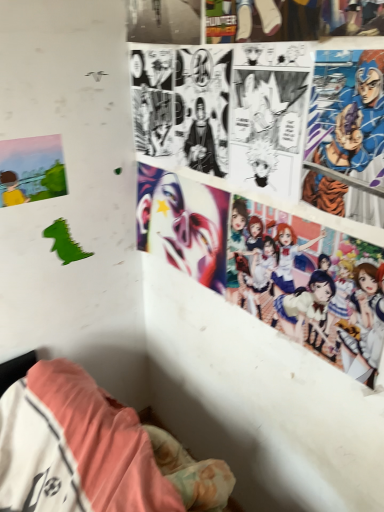
Find the location of a particular element. shiny metallic mask at center is located at coordinates (188, 228).

The width and height of the screenshot is (384, 512). What do you see at coordinates (346, 141) in the screenshot? I see `blue metallic armor at upper right, acting as the 1th person starting from the top` at bounding box center [346, 141].

Describe the element at coordinates (31, 170) in the screenshot. I see `matte paper poster at left` at that location.

Find the location of a particular element. Image resolution: width=384 pixels, height=512 pixels. shiny metallic mask at center is located at coordinates 188,228.

From the image's perspective, which is above, colorful anime characters at upper right, which is the first person in bottom-to-top order, or shiny metallic mask at center?

From the image's view, shiny metallic mask at center is above.

Considering the sizes of objects colorful anime characters at upper right, which is the first person in bottom-to-top order, and shiny metallic mask at center in the image provided, who is thinner, colorful anime characters at upper right, which is the first person in bottom-to-top order, or shiny metallic mask at center?

With smaller width is colorful anime characters at upper right, which is the first person in bottom-to-top order.

Based on the photo, based on their sizes in the image, would you say colorful anime characters at upper right, which is counted as the 2th person, starting from the top, is bigger or smaller than shiny metallic mask at center?

In the image, colorful anime characters at upper right, which is counted as the 2th person, starting from the top, appears to be smaller than shiny metallic mask at center.

From a real-world perspective, which object stands above the other?

shiny metallic mask at center is physically above.

How far apart are shiny metallic mask at center and matte paper poster at left?

shiny metallic mask at center is 14.66 inches from matte paper poster at left.

Which of these two, shiny metallic mask at center or matte paper poster at left, stands shorter?

matte paper poster at left is shorter.

Considering the relative positions of shiny metallic mask at center and matte paper poster at left in the image provided, is shiny metallic mask at center to the left of matte paper poster at left from the viewer's perspective?

In fact, shiny metallic mask at center is to the right of matte paper poster at left.

At what (x,y) coordinates should I click in order to perform the action: click on poster page above the shiny metallic mask at center (from the image's perspective). Please return your answer as a coordinate pair (x, y). The height and width of the screenshot is (512, 384). Looking at the image, I should click on (31, 170).

Considering the positions of points (372, 257) and (49, 144), is point (372, 257) closer to camera compared to point (49, 144)?

Yes.

Is matte paper poster at left a part of colorful anime characters at upper right, which is counted as the 2th person, starting from the top?

Actually, matte paper poster at left is outside colorful anime characters at upper right, which is counted as the 2th person, starting from the top.

How different are the orientations of colorful anime characters at upper right, which is counted as the 2th person, starting from the top, and matte paper poster at left in degrees?

There is a 89.3-degree angle between the facing directions of colorful anime characters at upper right, which is counted as the 2th person, starting from the top, and matte paper poster at left.

Who is bigger, colorful anime characters at upper right, which is counted as the 2th person, starting from the top, or matte paper poster at left?

colorful anime characters at upper right, which is counted as the 2th person, starting from the top, is bigger.

How distant is blue metallic armor at upper right, acting as the 1th person starting from the top, from colorful anime characters at upper right, which is the first person in bottom-to-top order?

blue metallic armor at upper right, acting as the 1th person starting from the top, and colorful anime characters at upper right, which is the first person in bottom-to-top order, are 7.33 inches apart.

Is blue metallic armor at upper right, acting as the 1th person starting from the top, in front of or behind colorful anime characters at upper right, which is counted as the 2th person, starting from the top, in the image?

Visually, blue metallic armor at upper right, acting as the 1th person starting from the top, is located in front of colorful anime characters at upper right, which is counted as the 2th person, starting from the top.

Considering the relative sizes of blue metallic armor at upper right, marked as the second person in a bottom-to-top arrangement, and colorful anime characters at upper right, which is the first person in bottom-to-top order, in the image provided, is blue metallic armor at upper right, marked as the second person in a bottom-to-top arrangement, thinner than colorful anime characters at upper right, which is the first person in bottom-to-top order,?

Indeed, blue metallic armor at upper right, marked as the second person in a bottom-to-top arrangement, has a lesser width compared to colorful anime characters at upper right, which is the first person in bottom-to-top order.

Based on their sizes in the image, would you say blue metallic armor at upper right, marked as the second person in a bottom-to-top arrangement, is bigger or smaller than colorful anime characters at upper right, which is the first person in bottom-to-top order?

Considering their sizes, blue metallic armor at upper right, marked as the second person in a bottom-to-top arrangement, takes up less space than colorful anime characters at upper right, which is the first person in bottom-to-top order.

Which object is more forward, blue metallic armor at upper right, marked as the second person in a bottom-to-top arrangement, or matte paper poster at left?

blue metallic armor at upper right, marked as the second person in a bottom-to-top arrangement.

What are the coordinates of `poster page below the blue metallic armor at upper right, acting as the 1th person starting from the top (from a real-world perspective)` in the screenshot? It's located at (31, 170).

From the image's perspective, is blue metallic armor at upper right, acting as the 1th person starting from the top, above or below matte paper poster at left?

From the image's perspective, blue metallic armor at upper right, acting as the 1th person starting from the top, appears below matte paper poster at left.

Which is behind, point (337, 145) or point (13, 203)?

The point (13, 203) is behind.

Is matte paper poster at left looking in the opposite direction of blue metallic armor at upper right, acting as the 1th person starting from the top?

No, matte paper poster at left's orientation is not away from blue metallic armor at upper right, acting as the 1th person starting from the top.

Is point (32, 139) closer to viewer compared to point (358, 109)?

No, (32, 139) is behind (358, 109).

From a real-world perspective, is matte paper poster at left beneath blue metallic armor at upper right, acting as the 1th person starting from the top?

Correct, in the physical world, matte paper poster at left is lower than blue metallic armor at upper right, acting as the 1th person starting from the top.

Is matte paper poster at left turned away from shiny metallic mask at center?

matte paper poster at left is not turned away from shiny metallic mask at center.

Is matte paper poster at left closer to the viewer compared to shiny metallic mask at center?

Yes, matte paper poster at left is closer to the viewer.

Based on the photo, is matte paper poster at left to the left of shiny metallic mask at center from the viewer's perspective?

Correct, you'll find matte paper poster at left to the left of shiny metallic mask at center.

Where is `person that is below the shiny metallic mask at center (from the image's perspective)`? This screenshot has height=512, width=384. person that is below the shiny metallic mask at center (from the image's perspective) is located at coordinates (309, 285).

I want to click on human face below the matte paper poster at left (from a real-world perspective), so click(188, 228).

When comparing their distances from blue metallic armor at upper right, acting as the 1th person starting from the top, does matte paper poster at left or colorful anime characters at upper right, which is counted as the 2th person, starting from the top, seem closer?

colorful anime characters at upper right, which is counted as the 2th person, starting from the top.

Which object lies further to the anchor point colorful anime characters at upper right, which is the first person in bottom-to-top order, shiny metallic mask at center or matte paper poster at left?

matte paper poster at left is positioned further to the anchor colorful anime characters at upper right, which is the first person in bottom-to-top order.

Which object lies further to the anchor point blue metallic armor at upper right, acting as the 1th person starting from the top, colorful anime characters at upper right, which is counted as the 2th person, starting from the top, or matte paper poster at left?

Among the two, matte paper poster at left is located further to blue metallic armor at upper right, acting as the 1th person starting from the top.

From the image, which object appears to be farther from shiny metallic mask at center, blue metallic armor at upper right, marked as the second person in a bottom-to-top arrangement, or colorful anime characters at upper right, which is counted as the 2th person, starting from the top?

blue metallic armor at upper right, marked as the second person in a bottom-to-top arrangement, is positioned further to the anchor shiny metallic mask at center.

Estimate the real-world distances between objects in this image. Which object is further from matte paper poster at left, shiny metallic mask at center or blue metallic armor at upper right, marked as the second person in a bottom-to-top arrangement?

Based on the image, blue metallic armor at upper right, marked as the second person in a bottom-to-top arrangement, appears to be further to matte paper poster at left.

Considering their positions, is blue metallic armor at upper right, acting as the 1th person starting from the top, positioned further to colorful anime characters at upper right, which is the first person in bottom-to-top order, than matte paper poster at left?

Based on the image, matte paper poster at left appears to be further to colorful anime characters at upper right, which is the first person in bottom-to-top order.

Based on their spatial positions, is matte paper poster at left or shiny metallic mask at center further from blue metallic armor at upper right, acting as the 1th person starting from the top?

matte paper poster at left is further to blue metallic armor at upper right, acting as the 1th person starting from the top.

From the image, which object appears to be nearer to shiny metallic mask at center, colorful anime characters at upper right, which is the first person in bottom-to-top order, or blue metallic armor at upper right, marked as the second person in a bottom-to-top arrangement?

colorful anime characters at upper right, which is the first person in bottom-to-top order.

The width and height of the screenshot is (384, 512). Identify the location of person located between matte paper poster at left and blue metallic armor at upper right, acting as the 1th person starting from the top, in the left-right direction. (309, 285).

Locate an element on the screen. The width and height of the screenshot is (384, 512). human face situated between matte paper poster at left and colorful anime characters at upper right, which is counted as the 2th person, starting from the top, from left to right is located at coordinates (188, 228).

At what (x,y) coordinates should I click in order to perform the action: click on person positioned between blue metallic armor at upper right, acting as the 1th person starting from the top, and shiny metallic mask at center from near to far. Please return your answer as a coordinate pair (x, y). The width and height of the screenshot is (384, 512). Looking at the image, I should click on (309, 285).

Locate an element on the screen. The width and height of the screenshot is (384, 512). human face between matte paper poster at left and blue metallic armor at upper right, marked as the second person in a bottom-to-top arrangement, from left to right is located at coordinates tap(188, 228).